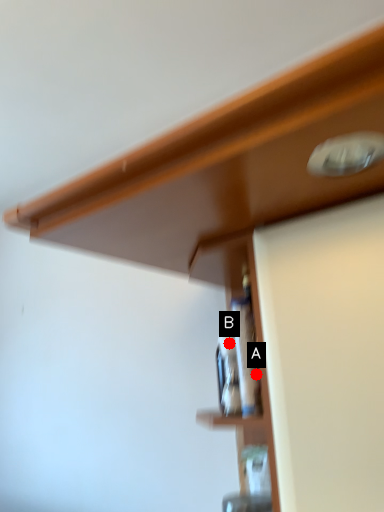
Question: Two points are circled on the image, labeled by A and B beside each circle. Among these points, which one is farthest from the camera?

Choices:
 (A) A is further
 (B) B is further

Answer: (B)